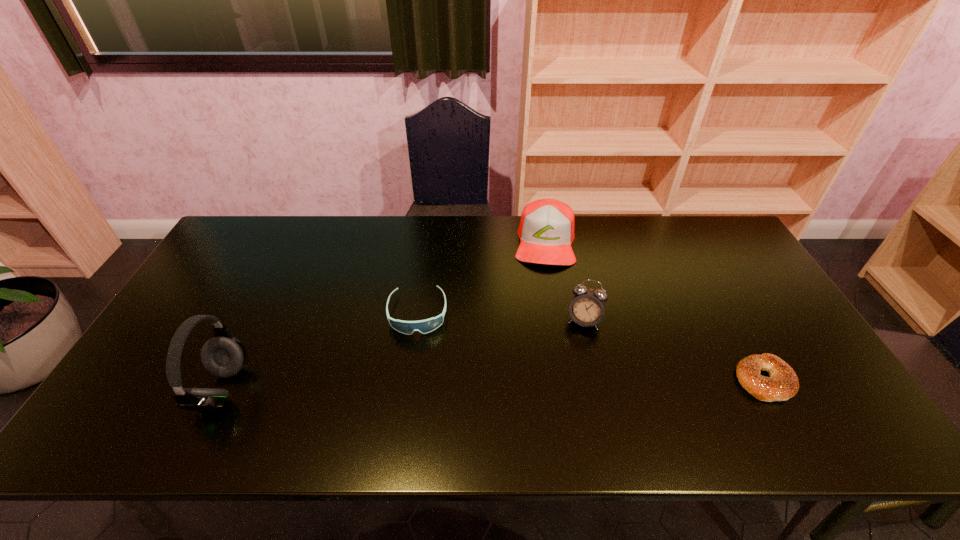
At what (x,y) coordinates should I click in order to perform the action: click on headset at the near edge. Please return your answer as a coordinate pair (x, y). The width and height of the screenshot is (960, 540). Looking at the image, I should click on (223, 356).

Locate an element on the screen. bagel located at the near edge is located at coordinates (783, 384).

This screenshot has height=540, width=960. Find the location of `object situated at the right edge`. object situated at the right edge is located at coordinates (783, 384).

The width and height of the screenshot is (960, 540). Find the location of `object positioned at the near right corner`. object positioned at the near right corner is located at coordinates (783, 384).

I want to click on vacant space at the far edge of the desktop, so click(x=501, y=224).

Image resolution: width=960 pixels, height=540 pixels. I want to click on vacant region at the near edge of the desktop, so click(x=537, y=386).

Where is `vacant space at the left edge of the desktop`? This screenshot has width=960, height=540. vacant space at the left edge of the desktop is located at coordinates (238, 281).

At what (x,y) coordinates should I click in order to perform the action: click on free point at the right edge. Please return your answer as a coordinate pair (x, y). Looking at the image, I should click on (759, 328).

Find the location of a particular element. free space at the near left corner of the desktop is located at coordinates (128, 393).

Find the location of a particular element. free space between the alarm clock and the rightmost object is located at coordinates (674, 350).